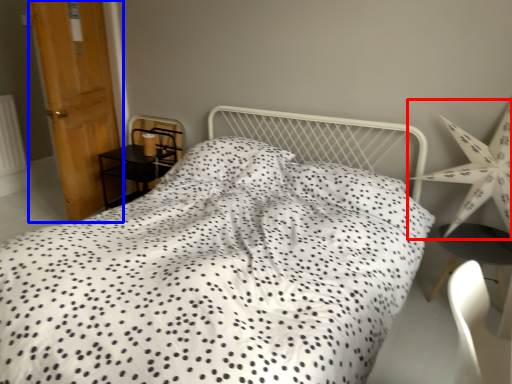
Question: Which point is further to the camera, star (highlighted by a red box) or door (highlighted by a blue box)?

Choices:
 (A) star
 (B) door

Answer: (B)